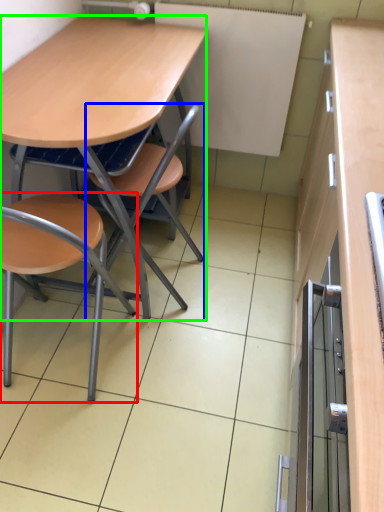
Question: Which object is the closest to the chair (highlighted by a red box)? Choose among these: chair (highlighted by a blue box) or desk (highlighted by a green box).

Choices:
 (A) chair
 (B) desk

Answer: (A)